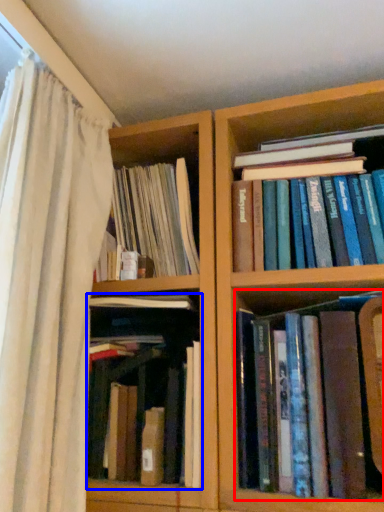
Question: Which of the following is the farthest to the observer, book (highlighted by a red box) or book (highlighted by a blue box)?

Choices:
 (A) book
 (B) book

Answer: (B)